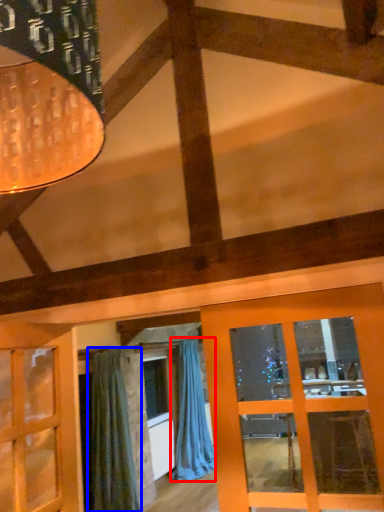
Question: Which object is further to the camera taking this photo, curtain (highlighted by a red box) or curtain (highlighted by a blue box)?

Choices:
 (A) curtain
 (B) curtain

Answer: (A)